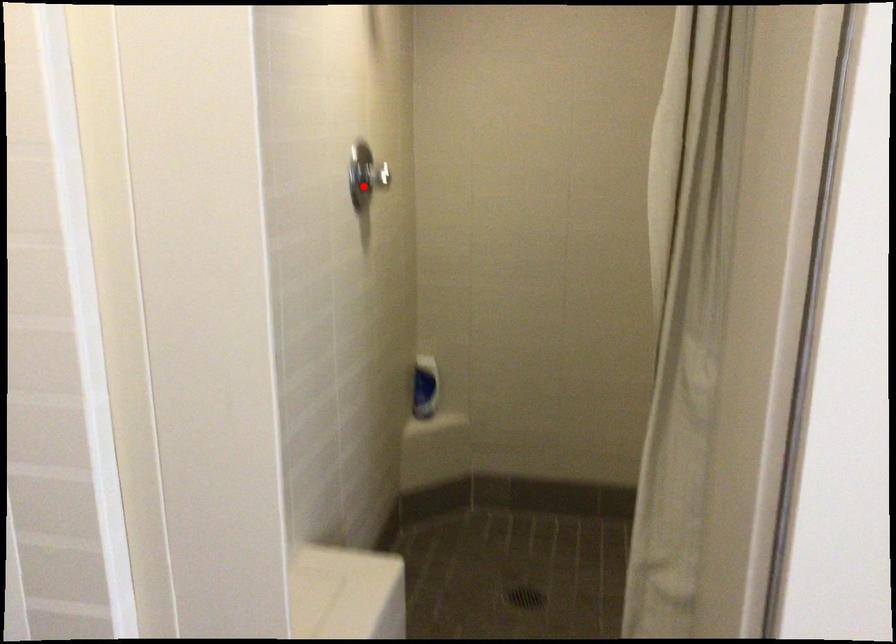
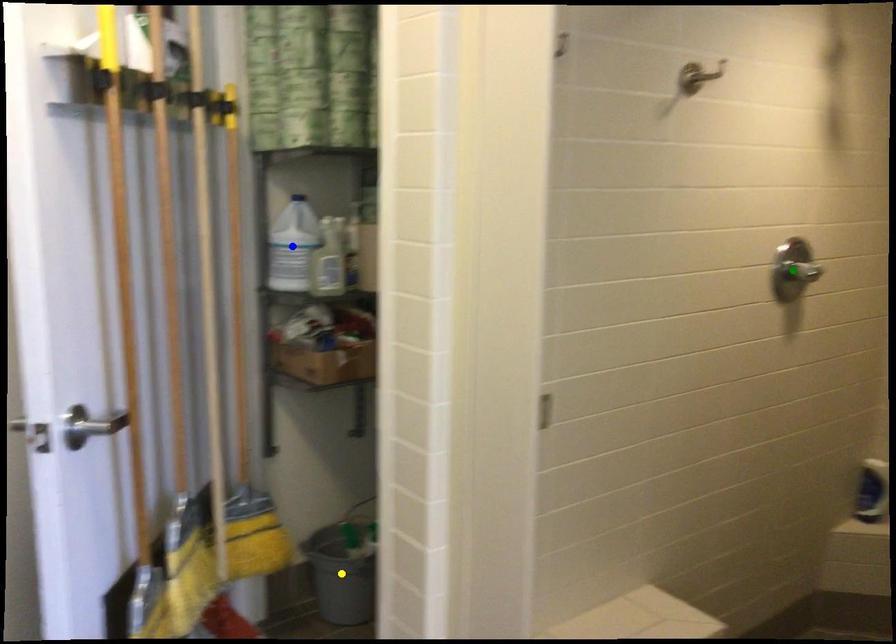
Question: I am providing you with two images of the same scene from different viewpoints. A red point is marked on the first image. You are given multiple points on the second image. Which point in image 2 is actually the same real-world point as the red point in image 1?

Choices:
 (A) green point
 (B) yellow point
 (C) blue point

Answer: (A)